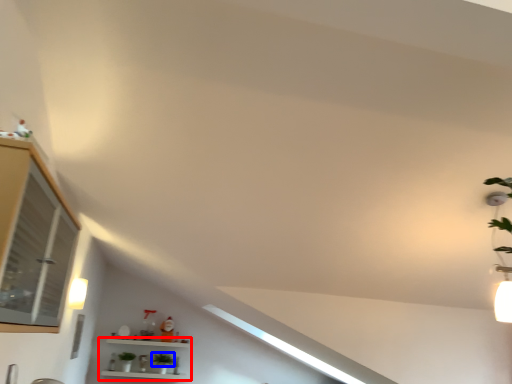
Question: Which object is closer to the camera taking this photo, shelf (highlighted by a red box) or plant (highlighted by a blue box)?

Choices:
 (A) shelf
 (B) plant

Answer: (A)